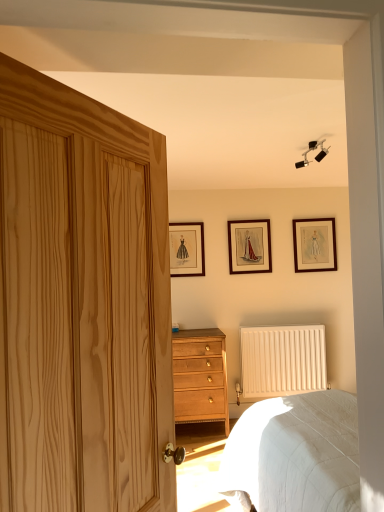
Question: Considering the positions of white quilted bed at lower right and light wood/texture chest of drawers at center in the image, is white quilted bed at lower right bigger or smaller than light wood/texture chest of drawers at center?

Choices:
 (A) small
 (B) big

Answer: (B)

Question: Considering the positions of white quilted bed at lower right and light wood/texture chest of drawers at center in the image, is white quilted bed at lower right taller or shorter than light wood/texture chest of drawers at center?

Choices:
 (A) short
 (B) tall

Answer: (A)

Question: Which object is the closest to the matte black picture frame at center, which is the second picture frame in right-to-left order?

Choices:
 (A) black matte track light at upper center
 (B) natural wood door at left
 (C) light wood/texture chest of drawers at center
 (D) white quilted bed at lower right
 (E) wooden picture frame at upper right, the first picture frame from the right

Answer: (E)

Question: Estimate the real-world distances between objects in this image. Which object is closer to the white matte radiator at lower center?

Choices:
 (A) white quilted bed at lower right
 (B) light wood/texture chest of drawers at center
 (C) natural wood door at left
 (D) black matte track light at upper center
 (E) wooden picture frame at upper right, the first picture frame from the right

Answer: (B)